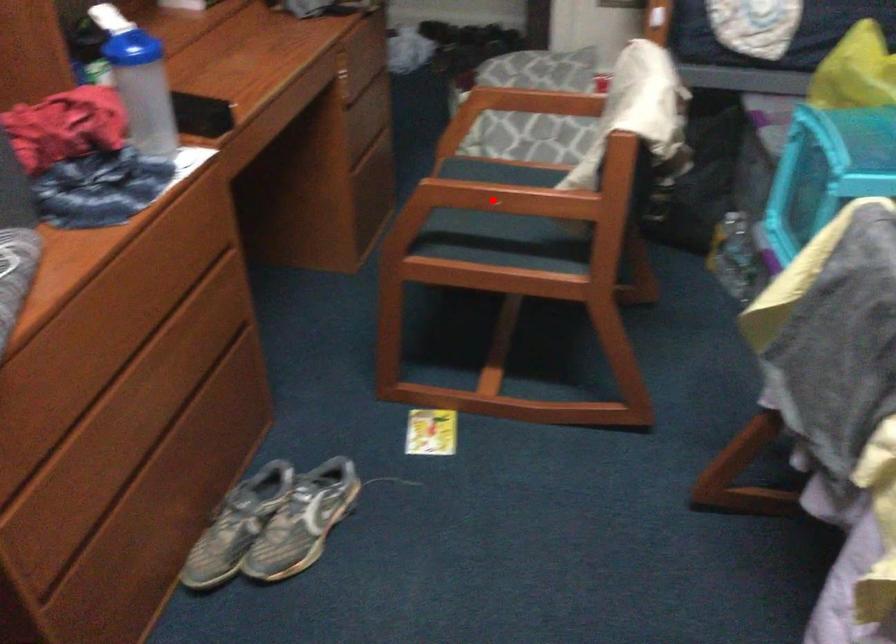
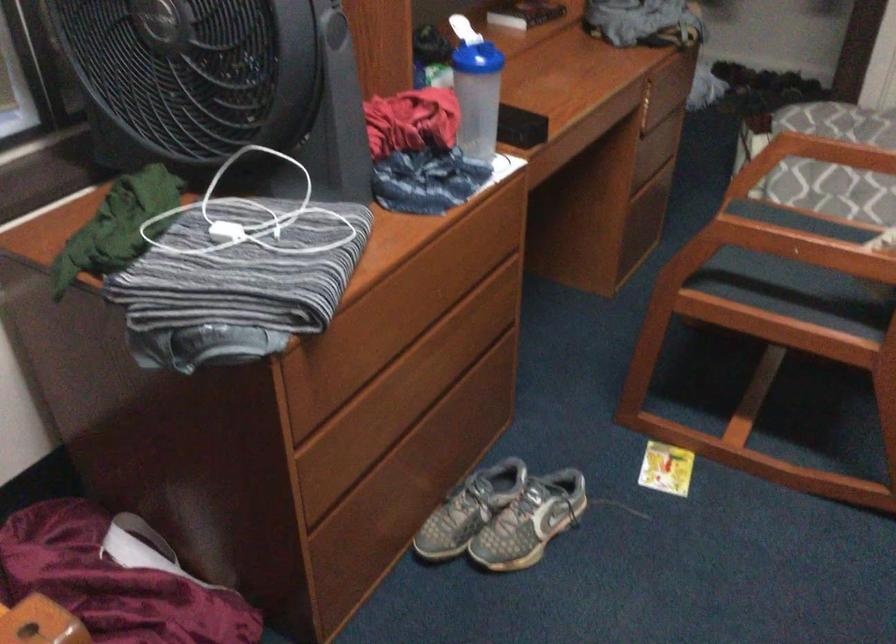
Find the pixel in the second image that matches the highlighted location in the first image.

(790, 245)